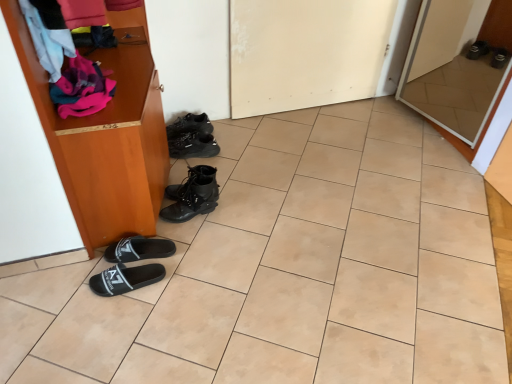
Identify the location of free space to the left of black fabric slipper at lower left, the 2th footwear when ordered from front to back. Image resolution: width=512 pixels, height=384 pixels. (95, 263).